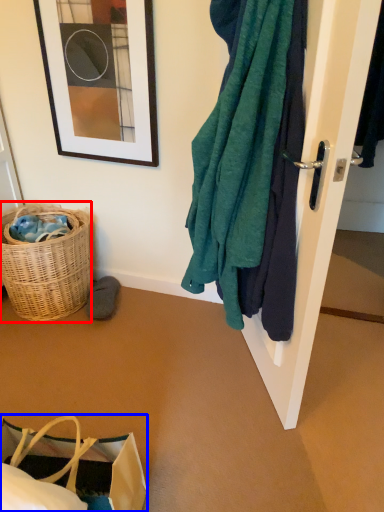
Question: Which object appears farthest to the camera in this image, picnic basket (highlighted by a red box) or handbag (highlighted by a blue box)?

Choices:
 (A) picnic basket
 (B) handbag

Answer: (A)